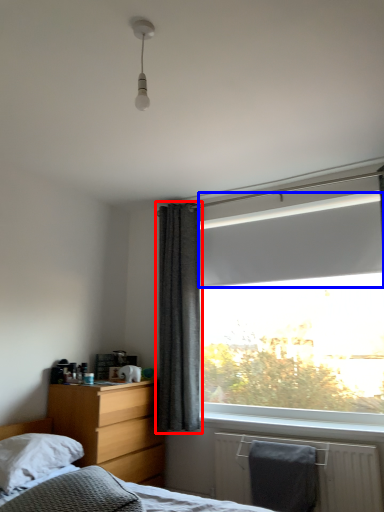
Question: Which point is closer to the camera, curtain (highlighted by a red box) or window screen (highlighted by a blue box)?

Choices:
 (A) curtain
 (B) window screen

Answer: (B)